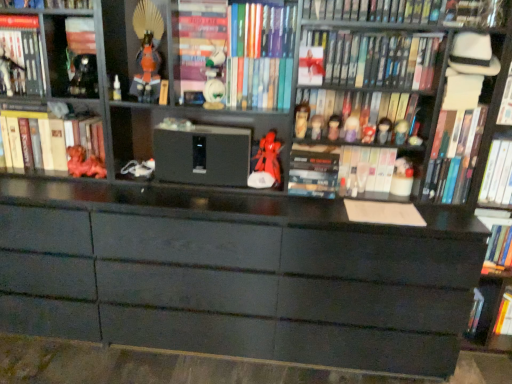
Describe the element at coordinates (402, 177) in the screenshot. I see `white matte cupcake at center-right, which ranks as the 16th toy in left-to-right order` at that location.

In order to face matte red figurine at left, acting as the 12th book starting from the right, should I rotate leftwards or rightwards?

A 25.745 degree turn to the left will do.

What is the approximate height of hardcover book at right, arranged as the 13th book when viewed from the left?

The height of hardcover book at right, arranged as the 13th book when viewed from the left, is 8.99 inches.

The image size is (512, 384). Describe the element at coordinates (497, 237) in the screenshot. I see `hardcover book at right, arranged as the 13th book when viewed from the left` at that location.

This screenshot has height=384, width=512. What do you see at coordinates (356, 114) in the screenshot?
I see `matte plastic figurines at center, the eighth book from the right` at bounding box center [356, 114].

Measure the distance between point (249, 178) and camera.

Point (249, 178) and camera are 6.39 feet apart.

You are a GUI agent. You are given a task and a screenshot of the screen. Output one action in this format:
    pyautogui.click(x=<x>, y=<y>)
    Task: Click on the matte black figurine at upper right, which appears as the 15th toy when viewed from the left
    
    Given the screenshot: What is the action you would take?
    tap(401, 131)

Is hardcover book at upper right, which ranks as the 7th book in right-to-left order, not close to multicolored hardcover books at center, the 5th book viewed from the left?

They are positioned close to each other.

From a real-world perspective, starting from the hardcover book at upper right, arranged as the seventh book when viewed from the left, which book is the 4th one below it? Please provide its 2D coordinates.

[(259, 83)]

From the picture: Considering the relative positions of hardcover book at upper right, arranged as the seventh book when viewed from the left, and multicolored hardcover books at center, acting as the ninth book starting from the right, in the image provided, is hardcover book at upper right, arranged as the seventh book when viewed from the left, behind multicolored hardcover books at center, acting as the ninth book starting from the right,?

That is False.

From a real-world perspective, which is physically above, hardcover book at upper right, arranged as the seventh book when viewed from the left, or multicolored hardcover books at center, acting as the ninth book starting from the right?

In real-world perspective, hardcover book at upper right, arranged as the seventh book when viewed from the left, is above.

Is matte plastic figurines at center, the eighth book from the right, to the left of metallic silver figurine at upper left, which is the sixteenth toy from right to left, from the viewer's perspective?

Incorrect, matte plastic figurines at center, the eighth book from the right, is not on the left side of metallic silver figurine at upper left, which is the sixteenth toy from right to left.

Does matte plastic figurines at center, the eighth book from the right, have a larger size compared to metallic silver figurine at upper left, which is the sixteenth toy from right to left?

Yes, matte plastic figurines at center, the eighth book from the right, is bigger than metallic silver figurine at upper left, which is the sixteenth toy from right to left.

Consider the image. Can metallic silver figurine at upper left, which is the sixteenth toy from right to left, be found inside matte plastic figurines at center, the eighth book from the right?

No.

In the scene shown: From a real-world perspective, who is located lower, matte plastic figurines at center, the sixth book when ordered from left to right, or metallic silver figurine at upper left, the 1th toy viewed from the left?

matte plastic figurines at center, the sixth book when ordered from left to right, is physically lower.

Which point is more distant from viewer, (145,174) or (402,159)?

The point (145,174) is behind.

Based on the photo, are white matte toy at center, which appears as the fifth toy when viewed from the left, and white matte cupcake at center-right, acting as the first toy starting from the right, making contact?

There is a gap between white matte toy at center, which appears as the fifth toy when viewed from the left, and white matte cupcake at center-right, acting as the first toy starting from the right.

Is white matte toy at center, the 12th toy viewed from the right, in front of white matte cupcake at center-right, acting as the first toy starting from the right?

No.

Based on their positions, is white matte toy at center, the 12th toy viewed from the right, located to the left or right of white matte cupcake at center-right, acting as the first toy starting from the right?

In the image, white matte toy at center, the 12th toy viewed from the right, appears on the left side of white matte cupcake at center-right, acting as the first toy starting from the right.

Looking at this image, is matte black cabinet at lower right, which is counted as the 1th cabinet, starting from the right, turned away from hardcover book at center, which is the 4th book from left to right?

No, matte black cabinet at lower right, which is counted as the 1th cabinet, starting from the right, is not facing the opposite direction of hardcover book at center, which is the 4th book from left to right.

Considering their positions, is matte black cabinet at lower right, acting as the second cabinet starting from the front, located in front of or behind hardcover book at center, which is the 4th book from left to right?

Clearly, matte black cabinet at lower right, acting as the second cabinet starting from the front, is behind hardcover book at center, which is the 4th book from left to right.

From a real-world perspective, is matte black cabinet at lower right, which appears as the first cabinet when ordered from the bottom, physically located above or below hardcover book at center, which is the 4th book from left to right?

matte black cabinet at lower right, which appears as the first cabinet when ordered from the bottom, is situated lower than hardcover book at center, which is the 4th book from left to right, in the real world.

From the image's perspective, is matte black cabinet at lower right, which ranks as the second cabinet in top-to-bottom order, above hardcover book at center, which is the 4th book from left to right?

No, from the image's perspective, matte black cabinet at lower right, which ranks as the second cabinet in top-to-bottom order, is not above hardcover book at center, which is the 4th book from left to right.

Considering the relative sizes of matte black book at upper left, the 13th book in the right-to-left sequence, and matte black figurine at center, positioned as the 4th toy in right-to-left order, in the image provided, is matte black book at upper left, the 13th book in the right-to-left sequence, bigger than matte black figurine at center, positioned as the 4th toy in right-to-left order,?

Correct, matte black book at upper left, the 13th book in the right-to-left sequence, is larger in size than matte black figurine at center, positioned as the 4th toy in right-to-left order.

In the image, is matte black book at upper left, the 13th book in the right-to-left sequence, on the left side or the right side of matte black figurine at center, which is the thirteenth toy in left-to-right order?

From the image, it's evident that matte black book at upper left, the 13th book in the right-to-left sequence, is to the left of matte black figurine at center, which is the thirteenth toy in left-to-right order.

In terms of height, does matte black book at upper left, the 13th book in the right-to-left sequence, look taller or shorter compared to matte black figurine at center, which is the thirteenth toy in left-to-right order?

matte black book at upper left, the 13th book in the right-to-left sequence, is taller than matte black figurine at center, which is the thirteenth toy in left-to-right order.

Locate an element on the screen. the 12th toy to the right of the matte black book at upper left, which is the 1th book in left-to-right order, starting your count from the anchor is located at coordinates (368, 133).

What's the angular difference between metallic silver figurine at upper left, the 3th toy when ordered from left to right, and white glossy book at center, which is the 9th book from left to right,'s facing directions?

The angular difference between metallic silver figurine at upper left, the 3th toy when ordered from left to right, and white glossy book at center, which is the 9th book from left to right, is 0.477 degrees.

Considering the positions of points (80, 81) and (391, 160), is point (80, 81) closer to camera compared to point (391, 160)?

That is True.

From the image's perspective, is metallic silver figurine at upper left, which appears as the 14th toy when viewed from the right, above or below white glossy book at center, which is the 9th book from left to right?

Based on their image positions, metallic silver figurine at upper left, which appears as the 14th toy when viewed from the right, is located above white glossy book at center, which is the 9th book from left to right.

From a real-world perspective, does metallic silver figurine at upper left, the 3th toy when ordered from left to right, sit lower than white glossy book at center, which appears as the fifth book when viewed from the right?

Actually, metallic silver figurine at upper left, the 3th toy when ordered from left to right, is physically above white glossy book at center, which appears as the fifth book when viewed from the right, in the real world.

Which book is the 6th one when counting from the right side of the matte red figurine at upper center, the 8th toy viewed from the right? Please provide its 2D coordinates.

[(476, 13)]

Is hardcover book at upper right, the eleventh book when ordered from left to right, turned away from matte red figurine at upper center, the ninth toy in the left-to-right sequence?

hardcover book at upper right, the eleventh book when ordered from left to right, does not have its back to matte red figurine at upper center, the ninth toy in the left-to-right sequence.

Choose the correct answer: Is hardcover book at upper right, arranged as the third book when viewed from the right, inside matte red figurine at upper center, the ninth toy in the left-to-right sequence, or outside it?

hardcover book at upper right, arranged as the third book when viewed from the right, is not inside matte red figurine at upper center, the ninth toy in the left-to-right sequence, it's outside.

Does point (496, 22) lie in front of point (321, 62)?

Yes, it is.

Locate an element on the screen. The width and height of the screenshot is (512, 384). book that is the 4th one below the hardcover book at upper right, arranged as the seventh book when viewed from the left (from a real-world perspective) is located at coordinates (259, 83).

From the matte plastic figurines at center, the eighth book from the right, count the 12th toy to the left and point to it. Please provide its 2D coordinates.

[(8, 68)]

From the image, which object appears to be farther from matte plastic figurine at center, acting as the 12th toy starting from the left, hardcover book at center or white glossy book at upper right, the twelfth book when ordered from left to right?

white glossy book at upper right, the twelfth book when ordered from left to right.

Which object lies further to the anchor point hardcover book at center, the 10th book in the right-to-left sequence, matte black cabinet at lower right, which is the 2th cabinet in left-to-right order, or matte black book at upper left, the 13th book in the right-to-left sequence?

matte black cabinet at lower right, which is the 2th cabinet in left-to-right order, is further to hardcover book at center, the 10th book in the right-to-left sequence.

Based on their spatial positions, is white matte cupcake at center-right, acting as the first toy starting from the right, or matte red figurine at upper center, the 8th toy viewed from the right, further from matte white figurine at center, the eleventh toy in the right-to-left sequence?

Based on the image, white matte cupcake at center-right, acting as the first toy starting from the right, appears to be further to matte white figurine at center, the eleventh toy in the right-to-left sequence.

Considering their positions, is matte plastic figurine at center, the eighth toy viewed from the left, positioned closer to matte red figurine at center, which ranks as the 10th toy in right-to-left order, than white matte cupcake at center-right, which ranks as the 16th toy in left-to-right order?

matte plastic figurine at center, the eighth toy viewed from the left, is closer to matte red figurine at center, which ranks as the 10th toy in right-to-left order.

From the image, which object appears to be nearer to matte plastic figurine at center, the eighth toy viewed from the left, matte black figurine at center, which is the 6th toy in right-to-left order, or metallic silver figurine at upper left, the 1th toy viewed from the left?

The object closer to matte plastic figurine at center, the eighth toy viewed from the left, is matte black figurine at center, which is the 6th toy in right-to-left order.

From the image, which object appears to be nearer to hardcover book at right, the 1th book viewed from the right, matte black figurine at upper left, the 2th cabinet from the back, or matte red figurine at center, positioned as the 7th toy in left-to-right order?

matte red figurine at center, positioned as the 7th toy in left-to-right order, is positioned closer to the anchor hardcover book at right, the 1th book viewed from the right.

When comparing their distances from matte red figurine at upper center, the ninth toy in the left-to-right sequence, does hardcover book at upper center, which appears as the eighth book when viewed from the left, or matte black figurine at center, positioned as the third toy in right-to-left order, seem further?

matte black figurine at center, positioned as the third toy in right-to-left order, is further to matte red figurine at upper center, the ninth toy in the left-to-right sequence.

From the picture: Based on their spatial positions, is matte black figurine at upper left, positioned as the eleventh book in right-to-left order, or matte black figurine at upper left, marked as the 1th cabinet in a front-to-back arrangement, closer to hardcover book at center, which is the 4th book from left to right?

matte black figurine at upper left, marked as the 1th cabinet in a front-to-back arrangement, lies closer to hardcover book at center, which is the 4th book from left to right, than the other object.

You are a GUI agent. You are given a task and a screenshot of the screen. Output one action in this format:
    pyautogui.click(x=<x>, y=<y>)
    Task: Click on the cabinet located between matte black figurine at upper left, the 3th book when ordered from left to right, and hardcover book at upper center, which appears as the 6th book when viewed from the right, in the left-right direction
    The image size is (512, 384).
    Given the screenshot: What is the action you would take?
    pyautogui.click(x=135, y=46)

You are a GUI agent. You are given a task and a screenshot of the screen. Output one action in this format:
    pyautogui.click(x=<x>, y=<y>)
    Task: Click on the cabinet located between translucent plastic bottle at upper left, placed as the 13th toy when sorted from right to left, and matte black figurine at center, positioned as the 4th toy in right-to-left order, in the left-right direction
    
    Given the screenshot: What is the action you would take?
    pyautogui.click(x=135, y=46)

This screenshot has width=512, height=384. I want to click on paperback book between translucent plastic bottle at upper left, the fourth toy from the left, and white glossy book at center, which appears as the fifth book when viewed from the right, so click(x=313, y=173).

In order to click on cabinet between metallic silver figurine at upper left, the 3th toy when ordered from left to right, and matte plastic figurines at center, the eighth book from the right in this screenshot , I will do `click(135, 46)`.